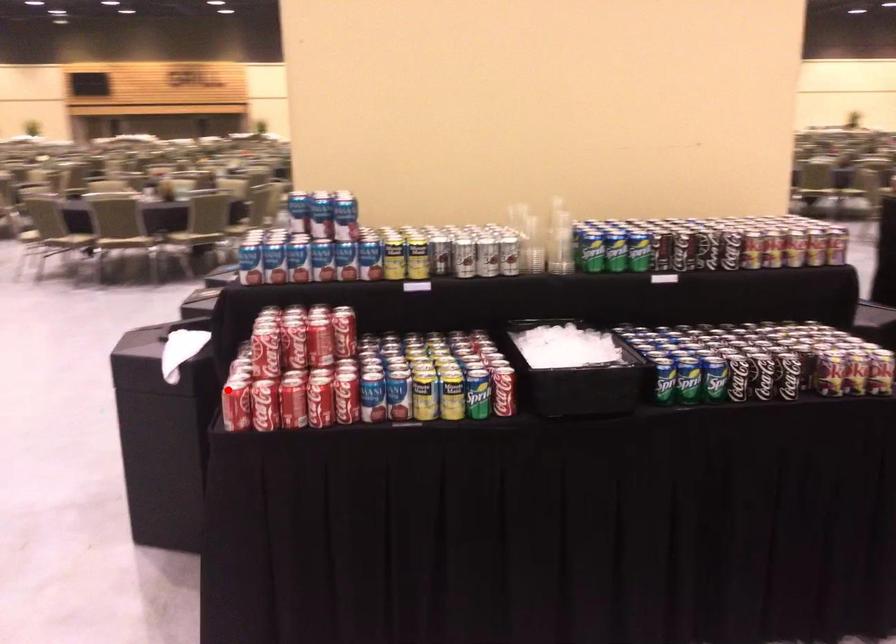
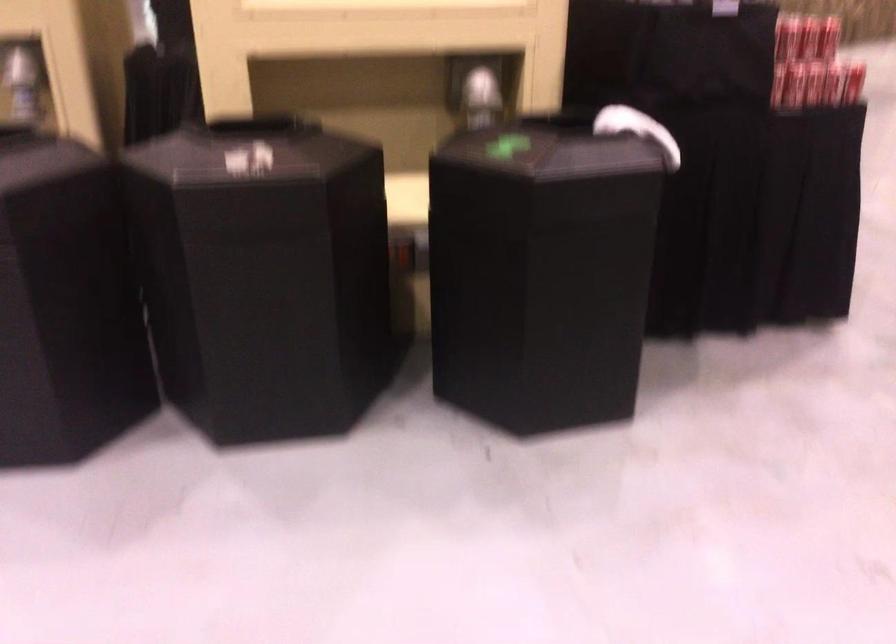
Question: I am providing you with two images of the same scene from different viewpoints. Image1 has a red point marked. In image2, the corresponding 3D location appears at what relative position? Reply with the corresponding letter.

Choices:
 (A) Closer
 (B) Farther

Answer: (B)